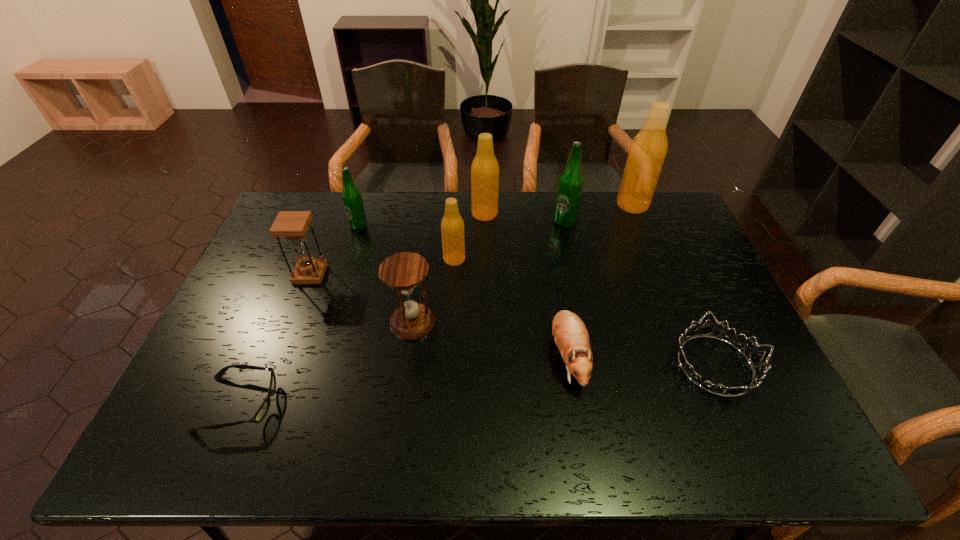
Where is `hourglass that is positioned at the left edge`? The image size is (960, 540). hourglass that is positioned at the left edge is located at coordinates (292, 225).

Find the location of a particular element. The height and width of the screenshot is (540, 960). spectacles that is positioned at the left edge is located at coordinates (264, 408).

You are a GUI agent. You are given a task and a screenshot of the screen. Output one action in this format:
    pyautogui.click(x=<x>, y=<y>)
    Task: Click on the beer bottle present at the right edge
    
    Given the screenshot: What is the action you would take?
    pyautogui.click(x=648, y=150)

Where is `tiara that is at the right edge`? The width and height of the screenshot is (960, 540). tiara that is at the right edge is located at coordinates (755, 358).

The width and height of the screenshot is (960, 540). I want to click on object present at the near left corner, so click(x=264, y=408).

This screenshot has width=960, height=540. I want to click on object at the far right corner, so click(648, 150).

You are a GUI agent. You are given a task and a screenshot of the screen. Output one action in this format:
    pyautogui.click(x=<x>, y=<y>)
    Task: Click on the vacant region at the far edge of the desktop
    Image resolution: width=960 pixels, height=540 pixels.
    Given the screenshot: What is the action you would take?
    pyautogui.click(x=516, y=210)

This screenshot has width=960, height=540. I want to click on vacant space at the near edge, so pos(391,429).

In the image, there is a desktop. At what (x,y) coordinates should I click in order to perform the action: click on vacant space at the left edge. Please return your answer as a coordinate pair (x, y). Looking at the image, I should click on (228, 319).

At what (x,y) coordinates should I click in order to perform the action: click on blank area at the right edge. Please return your answer as a coordinate pair (x, y). This screenshot has width=960, height=540. Looking at the image, I should click on (692, 262).